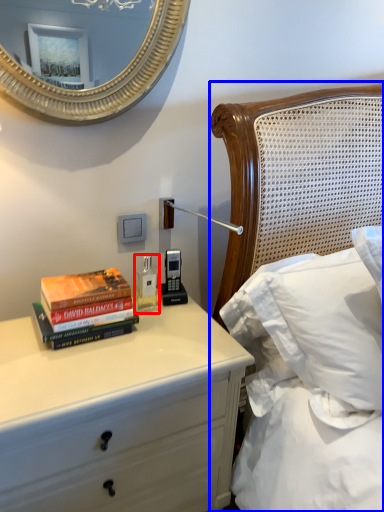
Question: Which object appears closest to the camera in this image, bottle (highlighted by a red box) or bed (highlighted by a blue box)?

Choices:
 (A) bottle
 (B) bed

Answer: (B)